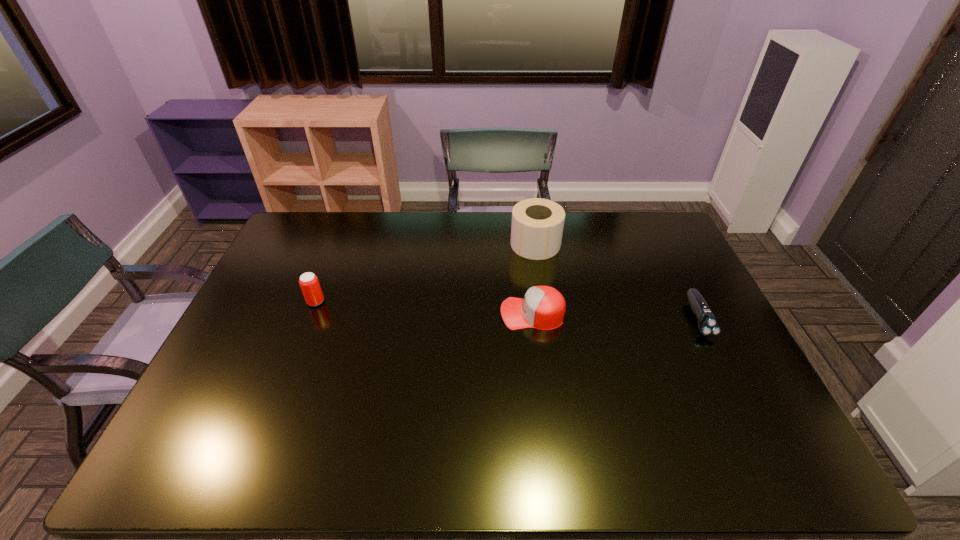
Select which object appears as the third closest to the baseball cap. Please provide its 2D coordinates. Your answer should be formatted as a tuple, i.e. [(x, y)], where the tuple contains the x and y coordinates of a point satisfying the conditions above.

[(309, 283)]